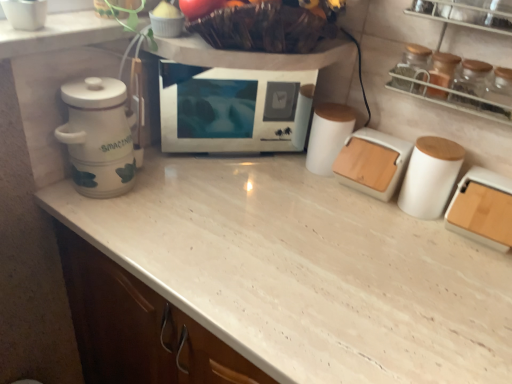
The width and height of the screenshot is (512, 384). What are the coordinates of `vacant space in between wooden lid container at right, which is the third kitchen appliance from left to right, and white ceramic canister at left` in the screenshot? It's located at (281, 219).